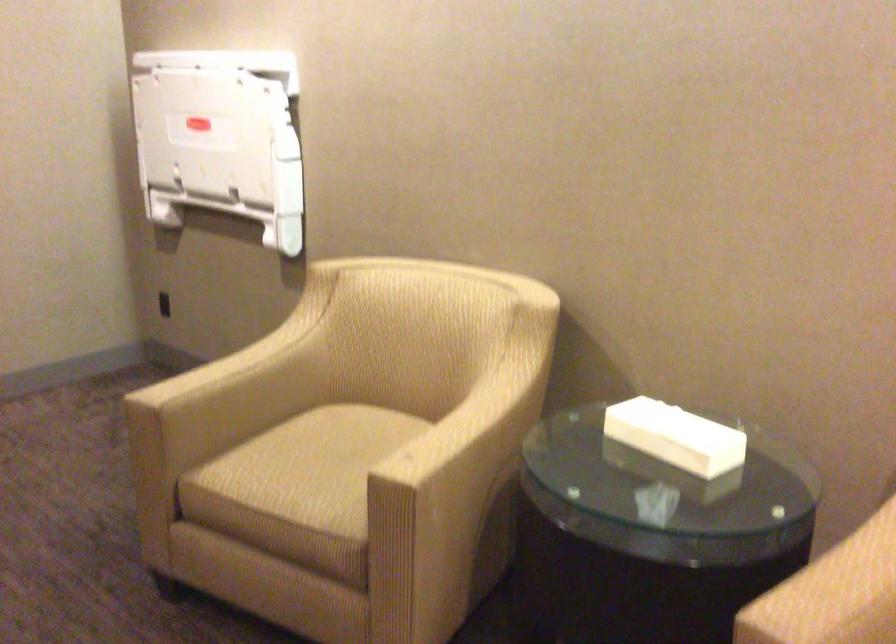
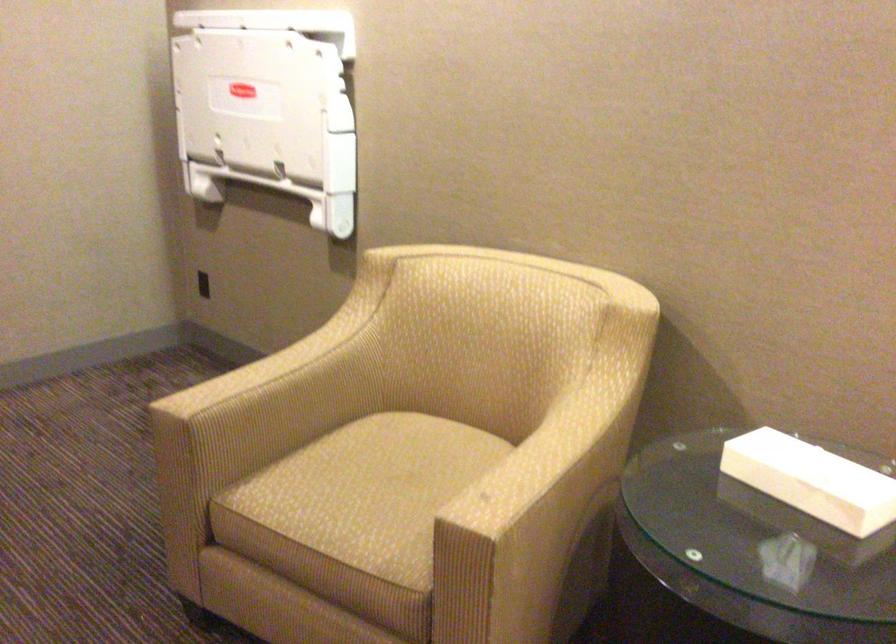
In the second image, find the point that corresponds to (205,213) in the first image.

(248, 187)